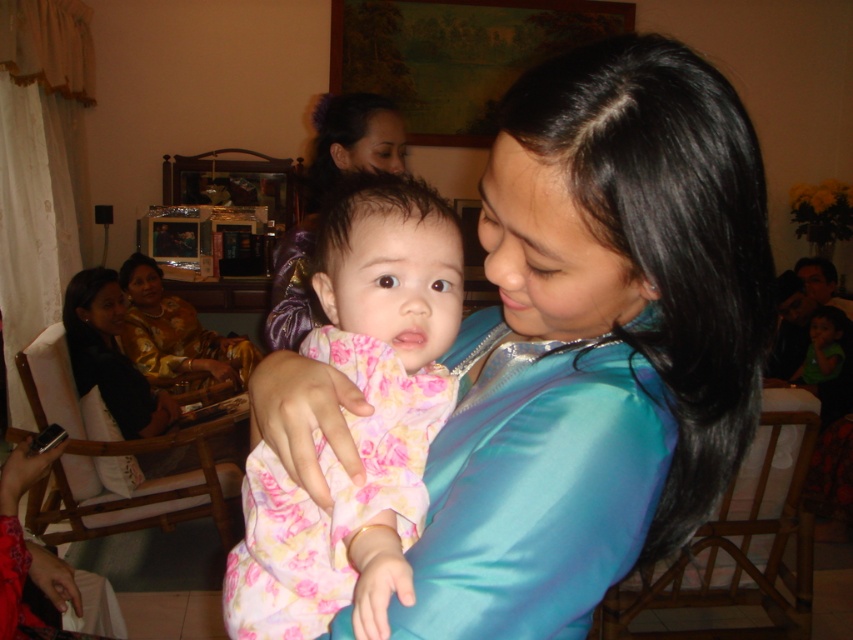
Question: Does teal satin dress at center come behind matte purple hair at center?

Choices:
 (A) no
 (B) yes

Answer: (A)

Question: Which point is closer to the camera taking this photo?

Choices:
 (A) 606,198
 (B) 230,554

Answer: (A)

Question: Which of the following is the farthest from the observer?

Choices:
 (A) (456, 276)
 (B) (177, 371)

Answer: (B)

Question: Is matte purple hair at center below gold satin dress at left?

Choices:
 (A) no
 (B) yes

Answer: (A)

Question: Which object is the closest to the matte purple hair at center?

Choices:
 (A) pink floral dress at center
 (B) gold satin dress at left
 (C) teal satin dress at center

Answer: (A)

Question: Is pink floral dress at center wider than matte purple hair at center?

Choices:
 (A) yes
 (B) no

Answer: (B)